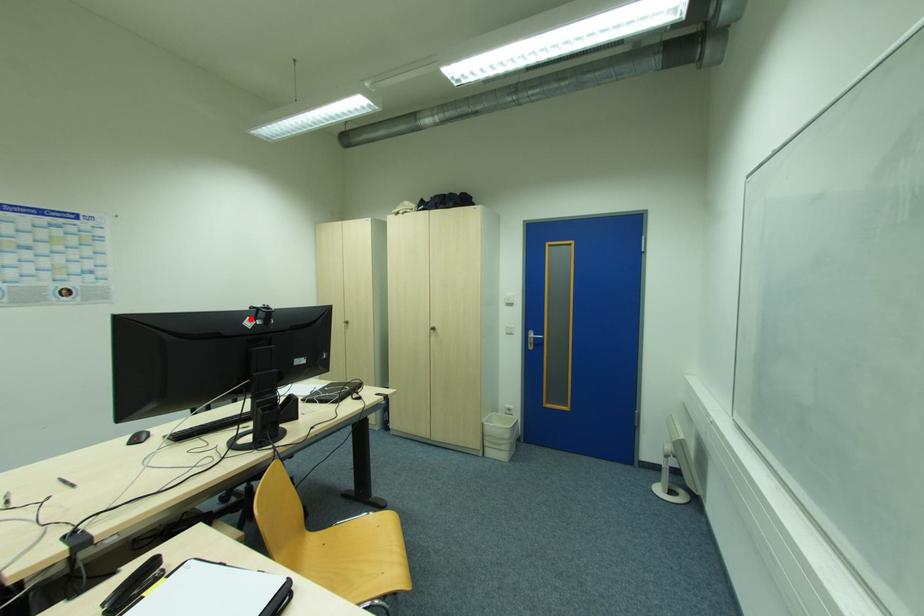
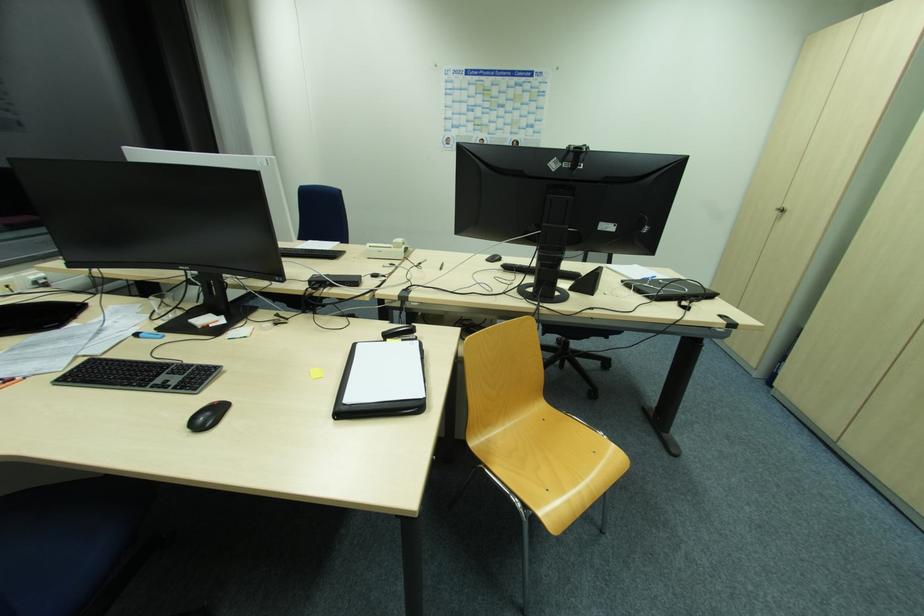
In the second image, find the point that corresponds to the highlighted location in the first image.

(557, 159)